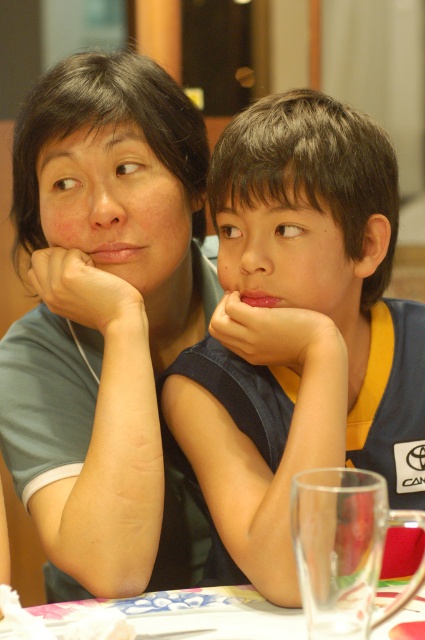
Between matte gray shirt at left and dark blue jersey at center, which one has more height?

Standing taller between the two is matte gray shirt at left.

Who is more distant from viewer, [27,477] or [257,358]?

Positioned behind is point [27,477].

The height and width of the screenshot is (640, 425). What do you see at coordinates (104, 314) in the screenshot? I see `matte gray shirt at left` at bounding box center [104, 314].

Identify the location of matte gray shirt at left. The image size is (425, 640). (104, 314).

Which is below, dark blue jersey at center or floral-patterned tablecloth at lower center?

floral-patterned tablecloth at lower center is lower down.

Is point (278, 545) positioned behind point (419, 637)?

Yes, point (278, 545) is behind point (419, 637).

Measure the distance between dark blue jersey at center and camera.

→ The distance of dark blue jersey at center from camera is 84.18 centimeters.

Find the location of `dark blue jersey at center`. dark blue jersey at center is located at coordinates (299, 330).

Which is more to the right, matte gray shirt at left or floral-patterned tablecloth at lower center?

Positioned to the right is floral-patterned tablecloth at lower center.

What do you see at coordinates (104, 314) in the screenshot?
I see `matte gray shirt at left` at bounding box center [104, 314].

Which is behind, point (129, 205) or point (136, 596)?

Positioned behind is point (129, 205).

I want to click on matte gray shirt at left, so click(104, 314).